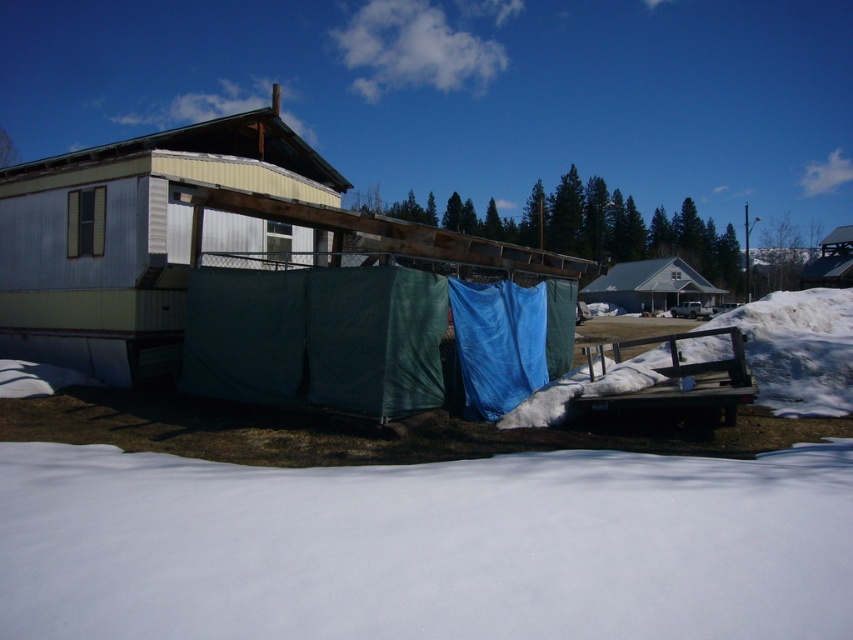
You are standing in the snowy outdoor scene and want to walk from the metal siding hut at left to the white matte house at center. Which direction should you head?

You should head to the right because the metal siding hut at left is to the left of the white matte house at center, so moving right would take you towards it.

You are standing at point (128, 237) in the snowy outdoor scene. What object is located exactly at this coordinate?

The metal siding hut at left is located exactly at point (128, 237).

Based on the photo, you are a delivery person trying to reach the white matte house at center. There is a metal siding hut at left in the way. Can you go around it to the right side to reach the house?

The metal siding hut at left is located above the white matte house at center, so the house is below the hut. This means the hut is elevated, so you can go around to the right side to reach the white matte house at center.